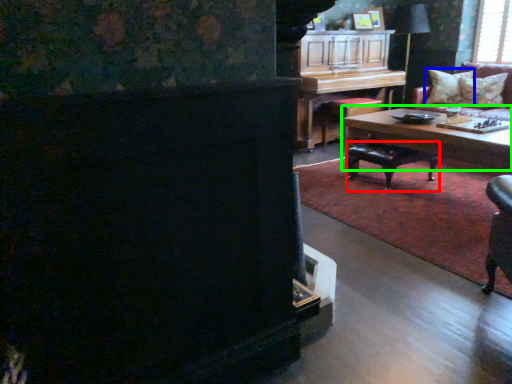
Question: Which is nearer to the stool (highlighted by a red box)? pillow (highlighted by a blue box) or coffee table (highlighted by a green box).

Choices:
 (A) pillow
 (B) coffee table

Answer: (B)